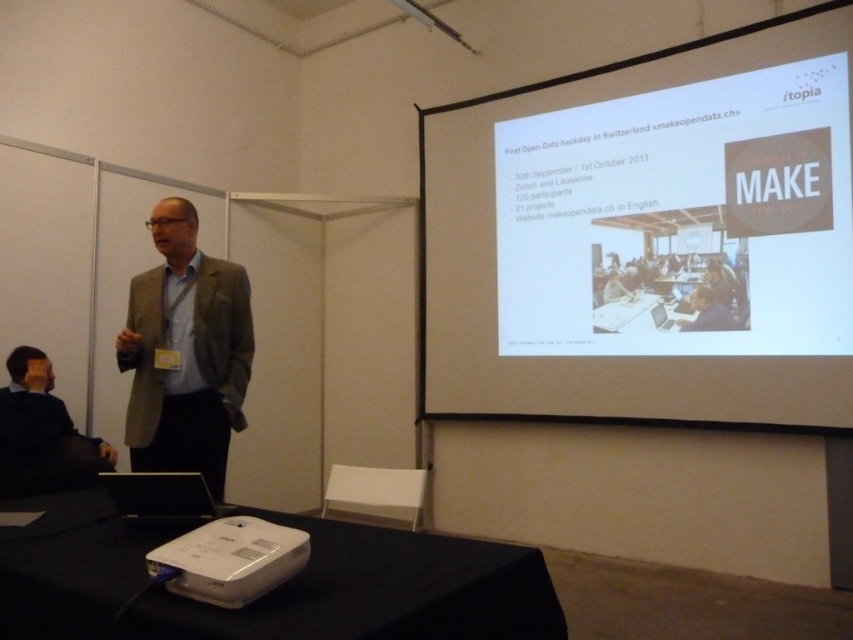
Question: Is black fabric projector at lower left positioned at the back of black fabric jacket at lower left?

Choices:
 (A) yes
 (B) no

Answer: (B)

Question: Is white matte projection screen at upper right to the right of light brown textured blazer at center from the viewer's perspective?

Choices:
 (A) no
 (B) yes

Answer: (B)

Question: Which object appears closest to the camera in this image?

Choices:
 (A) light brown textured blazer at center
 (B) black fabric jacket at lower left

Answer: (A)

Question: Does black fabric projector at lower left lie behind light brown textured blazer at center?

Choices:
 (A) yes
 (B) no

Answer: (B)

Question: Which object is positioned closest to the black fabric jacket at lower left?

Choices:
 (A) black fabric projector at lower left
 (B) white matte projection screen at upper right
 (C) light brown textured blazer at center

Answer: (C)

Question: Which point is closer to the camera?

Choices:
 (A) (154, 346)
 (B) (55, 419)

Answer: (A)